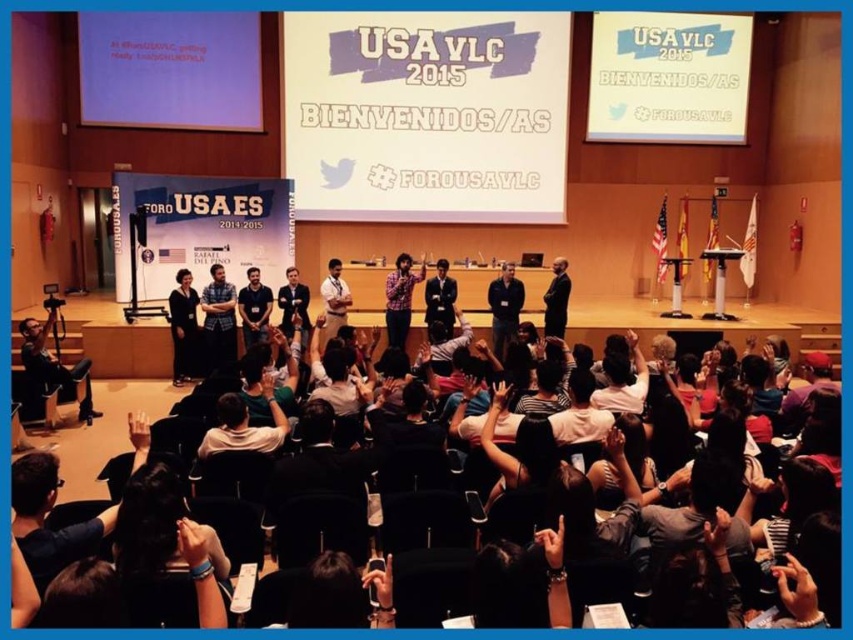
From the picture: You are a photographer at the event and need to capture a clear photo of the dark blue shirt at center without the matte black camera at lower left appearing in the frame. Is this possible based on their positions?

The matte black camera at lower left is positioned under the dark blue shirt at center, so adjusting the camera angle upwards to focus on the dark blue shirt at center while avoiding the matte black camera at lower left should be possible.

You are a photographer positioned at the back of the room. You need to capture a clear photo of the stage using your matte black camera at lower left. Considering the camera is 7.43 meters away from the stage, is this distance within a typical professional photography range for such events?

The matte black camera at lower left is 7.43 meters away from the viewer. In professional photography, capturing clear images at distances up to 10 meters is achievable with appropriate equipment. Since 7.43 meters is within this range, the photographer can take a clear photo.